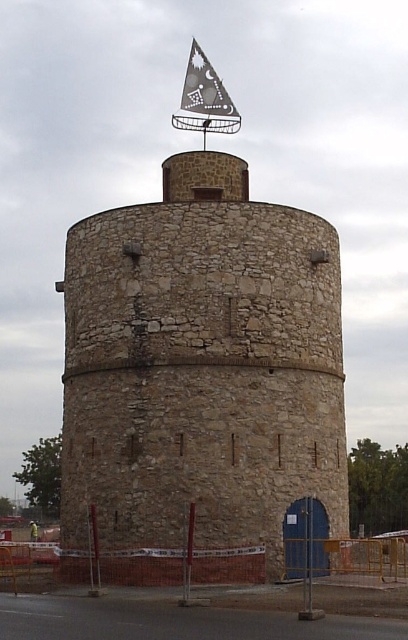
Which of these two, stone tower at center or gray fabric flag at top, stands taller?

Standing taller between the two is stone tower at center.

Where is `stone tower at center`? stone tower at center is located at coordinates (201, 368).